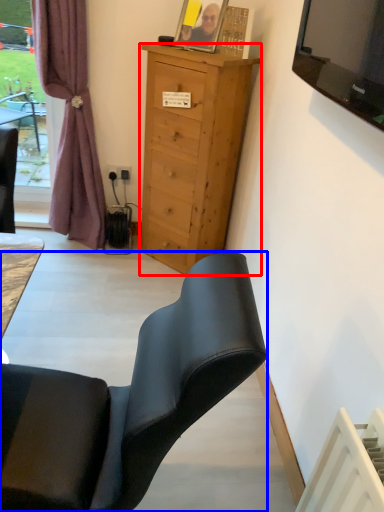
Question: Among these objects, which one is nearest to the camera, cabinetry (highlighted by a red box) or chair (highlighted by a blue box)?

Choices:
 (A) cabinetry
 (B) chair

Answer: (B)